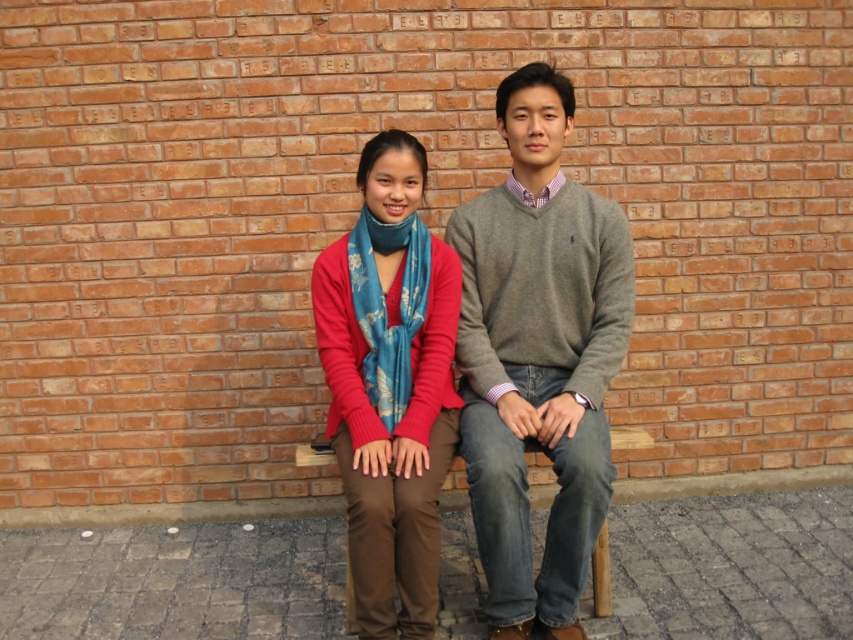
Who is positioned more to the left, gray sweater at center or matte blue scarf at center?

Positioned to the left is matte blue scarf at center.

From the picture: Is gray sweater at center positioned before matte blue scarf at center?

No, gray sweater at center is behind matte blue scarf at center.

Which is behind, point (527, 580) or point (378, 483)?

The point (527, 580) is behind.

Where is `gray sweater at center`? This screenshot has height=640, width=853. gray sweater at center is located at coordinates (538, 356).